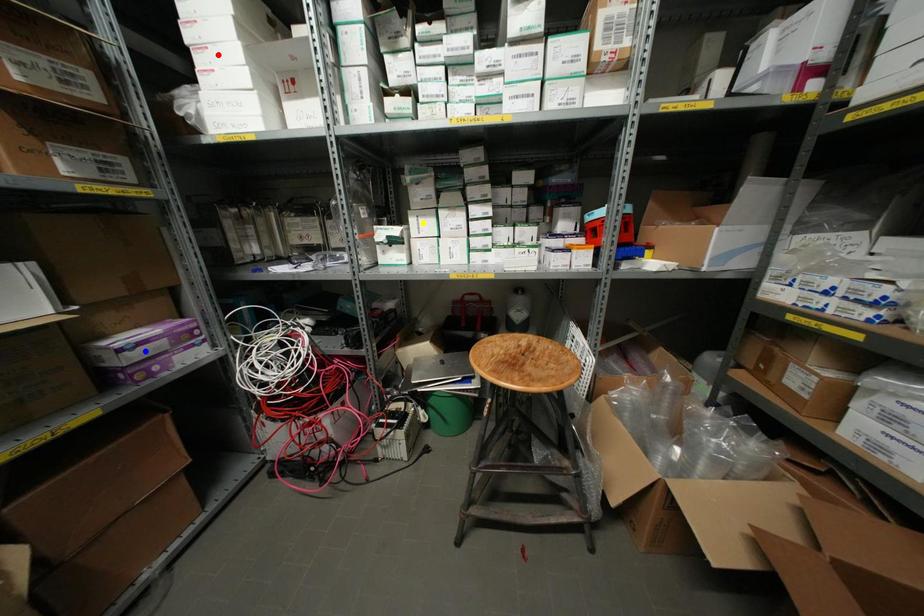
Order these from nearest to farthest:
1. yellow point
2. red point
3. blue point

blue point → red point → yellow point